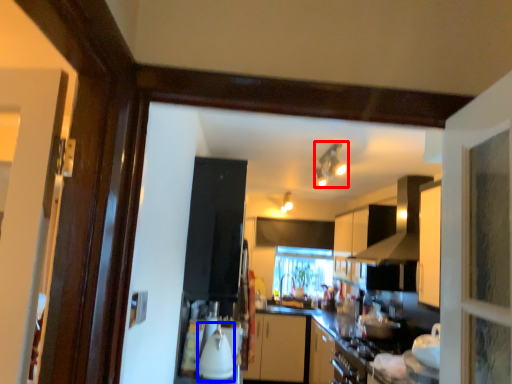
Question: Which point is further to the camera, light fixture (highlighted by a red box) or appliance (highlighted by a blue box)?

Choices:
 (A) light fixture
 (B) appliance

Answer: (A)